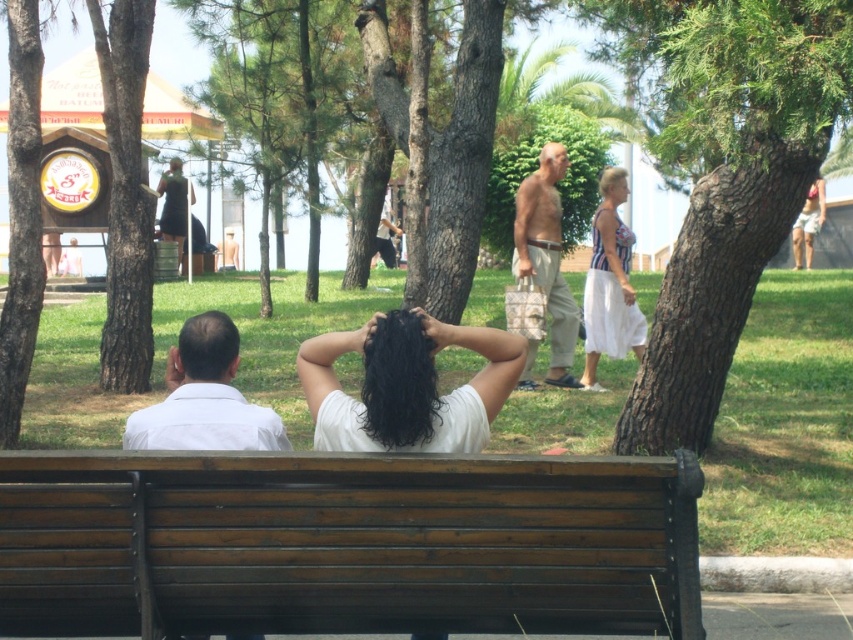
You are a photographer setting up a tripod in the park. You want to take a photo of both the white matte shirt at center and the white shirt at left so that both are fully visible. Given their heights, which person should be positioned closer to the camera to ensure both are in focus?

The white matte shirt at center is taller than the white shirt at left. To ensure both are fully visible and in focus, position the white shirt at left closer to the camera since it is shorter, allowing the photographer to adjust the focal length to accommodate both heights.

You are a photographer setting up a tripod in this park scene. You need to position it between the white matte shirt at center and the white shirt at left so that it doesn

The white matte shirt at center is to the right of the white shirt at left, so place the tripod between them on the grassy area between the two objects.

You are standing at the origin point of the coordinate system in the park scene. The brown wooden bench at center is located at coordinates point 0.852, 0.407. If you want to walk directly towards the bench, in which general direction should you head?

The brown wooden bench at center is located at coordinates point [346,545]. Since the coordinate system likely places the origin at the bottom left corner, moving towards positive x and y directions would mean heading northeast. Therefore, you should head northeast to reach the bench.